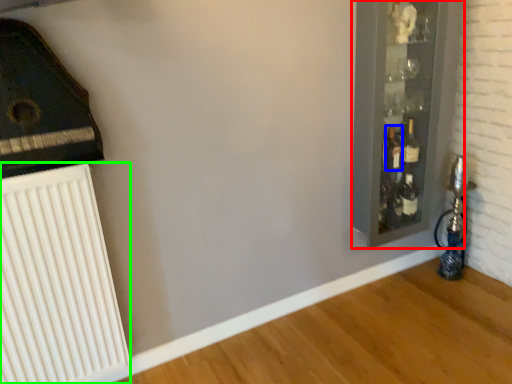
Question: Which object is the closest to the glass door (highlighted by a red box)? Choose among these: bottle (highlighted by a blue box) or radiator (highlighted by a green box).

Choices:
 (A) bottle
 (B) radiator

Answer: (A)